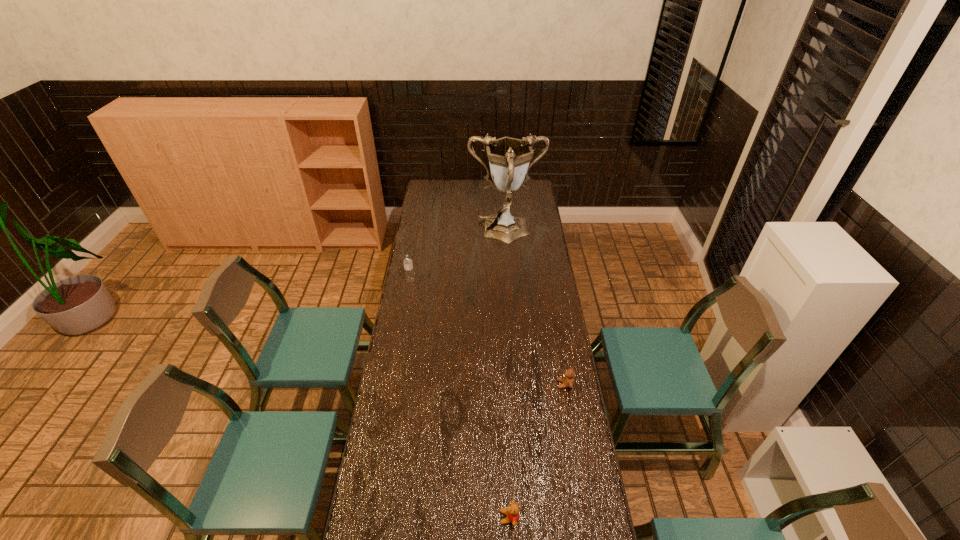
In the image, there is a desktop. Where is `free space at the left edge`? free space at the left edge is located at coordinates (360, 516).

Identify the location of vacant area at the right edge. This screenshot has height=540, width=960. (560, 444).

The image size is (960, 540). I want to click on free space at the far right corner of the desktop, so click(532, 197).

Locate an element on the screen. Image resolution: width=960 pixels, height=540 pixels. empty location between the nearest object and the water bottle is located at coordinates (460, 399).

Find the location of a particular element. The height and width of the screenshot is (540, 960). free space that is in between the right teddy bear and the left teddy bear is located at coordinates (537, 451).

You are a GUI agent. You are given a task and a screenshot of the screen. Output one action in this format:
    pyautogui.click(x=<x>, y=<y>)
    Task: Click on the free space between the left teddy bear and the farther teddy bear
    Image resolution: width=960 pixels, height=540 pixels.
    Given the screenshot: What is the action you would take?
    [x=537, y=451]

Locate an element on the screen. Image resolution: width=960 pixels, height=540 pixels. free spot between the tallest object and the second farthest object is located at coordinates [458, 256].

In order to click on vacant area between the right teddy bear and the nearest object in this screenshot , I will do `click(537, 451)`.

I want to click on free spot between the second tallest object and the right teddy bear, so click(488, 333).

Where is `empty space that is in between the trophy cup and the nearer teddy bear`? This screenshot has height=540, width=960. empty space that is in between the trophy cup and the nearer teddy bear is located at coordinates (508, 375).